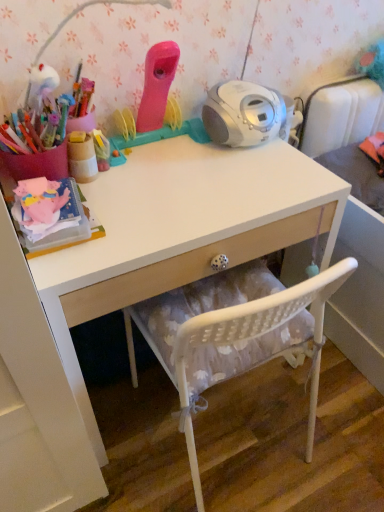
Question: Visually, is white mesh chair at lower center positioned to the left or to the right of white glossy desk at center?

Choices:
 (A) left
 (B) right

Answer: (B)

Question: Considering the positions of white mesh chair at lower center and white glossy desk at center in the image, is white mesh chair at lower center taller or shorter than white glossy desk at center?

Choices:
 (A) short
 (B) tall

Answer: (A)

Question: Estimate the real-world distances between objects in this image. Which object is closer to the wooden cup at upper left?

Choices:
 (A) white mesh chair at lower center
 (B) white glossy desk at center

Answer: (B)

Question: Which of these objects is positioned closest to the white glossy desk at center?

Choices:
 (A) white mesh chair at lower center
 (B) wooden cup at upper left

Answer: (A)